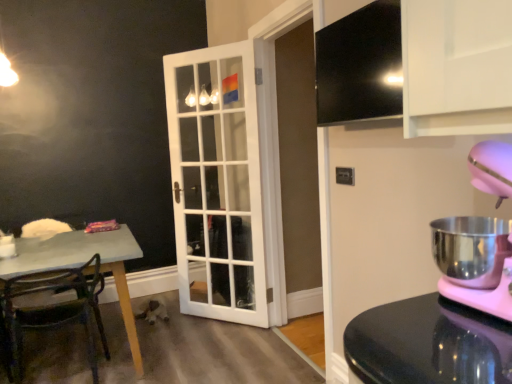
Locate an element on the screen. The height and width of the screenshot is (384, 512). metallic green chair at left is located at coordinates (55, 308).

What do you see at coordinates (492, 167) in the screenshot? I see `pink plastic mixer at right` at bounding box center [492, 167].

In order to face white glass door at center, should I rotate leftwards or rightwards?

To face it directly, rotate left by 5.416 degrees.

I want to click on white glossy coffee cup at lower left, so click(x=7, y=247).

Would you say white glass door at center is outside black glossy exhaust hood at upper right?

That's correct, white glass door at center is outside of black glossy exhaust hood at upper right.

Can you confirm if white glass door at center is positioned to the right of black glossy exhaust hood at upper right?

No.

Considering the sizes of objects white glass door at center and black glossy exhaust hood at upper right in the image provided, who is shorter, white glass door at center or black glossy exhaust hood at upper right?

black glossy exhaust hood at upper right is shorter.

Considering their positions, is white glass door at center located in front of or behind black glossy exhaust hood at upper right?

white glass door at center is positioned farther from the viewer than black glossy exhaust hood at upper right.

This screenshot has width=512, height=384. In order to click on coffee cup directly beneath the pink plastic mixer at right (from a real-world perspective) in this screenshot , I will do `click(7, 247)`.

Considering the sizes of white glossy coffee cup at lower left and pink plastic mixer at right in the image, is white glossy coffee cup at lower left bigger or smaller than pink plastic mixer at right?

Clearly, white glossy coffee cup at lower left is smaller in size than pink plastic mixer at right.

Does white glossy coffee cup at lower left appear on the right side of pink plastic mixer at right?

No.

Are white glossy coffee cup at lower left and pink plastic mixer at right located far from each other?

Absolutely, white glossy coffee cup at lower left is distant from pink plastic mixer at right.

Which of these two, pink plastic mixer at right or white glass door at center, is wider?

pink plastic mixer at right.

From a real-world perspective, is pink plastic mixer at right located higher than white glass door at center?

Yes, from a real-world perspective, pink plastic mixer at right is on top of white glass door at center.

How different are the orientations of pink plastic mixer at right and white glass door at center in degrees?

The angular difference between pink plastic mixer at right and white glass door at center is 133 degrees.

Between point (486, 184) and point (228, 89), which one is positioned in front?

The point (486, 184) is closer to the camera.

Is white glass door at center looking in the opposite direction of metallic green chair at left?

No, metallic green chair at left is not at the back of white glass door at center.

Is white glass door at center taller or shorter than metallic green chair at left?

In the image, white glass door at center appears to be taller than metallic green chair at left.

Considering the relative positions of white glass door at center and metallic green chair at left in the image provided, is white glass door at center behind metallic green chair at left?

Yes.

Based on the photo, from the image's perspective, which object appears higher, white glass door at center or metallic green chair at left?

white glass door at center is shown above in the image.

Could you tell me if black glossy exhaust hood at upper right is turned towards metallic green chair at left?

No, black glossy exhaust hood at upper right is not aimed at metallic green chair at left.

Can you confirm if black glossy exhaust hood at upper right is taller than metallic green chair at left?

No, black glossy exhaust hood at upper right is not taller than metallic green chair at left.

Who is bigger, black glossy exhaust hood at upper right or metallic green chair at left?

Bigger between the two is metallic green chair at left.

Would you say pink plastic mixer at right is inside or outside white glossy coffee cup at lower left?

pink plastic mixer at right is not inside white glossy coffee cup at lower left, it's outside.

Is point (492, 186) in front of point (3, 238)?

That is True.

Looking at this image, is pink plastic mixer at right wider than white glossy coffee cup at lower left?

Yes, pink plastic mixer at right is wider than white glossy coffee cup at lower left.

Is the depth of pink plastic mixer at right greater than that of white glossy coffee cup at lower left?

No, pink plastic mixer at right is in front of white glossy coffee cup at lower left.

How many degrees apart are the facing directions of pink plastic mixer at right and metallic green chair at left?

8.64e-05 degrees.

From a real-world perspective, does pink plastic mixer at right stand above metallic green chair at left?

Yes, from a real-world perspective, pink plastic mixer at right is above metallic green chair at left.

Are pink plastic mixer at right and metallic green chair at left located far from each other?

pink plastic mixer at right is positioned a significant distance from metallic green chair at left.

Is pink plastic mixer at right inside or outside of metallic green chair at left?

pink plastic mixer at right is not enclosed by metallic green chair at left.

In order to click on door on the left of black glossy exhaust hood at upper right in this screenshot , I will do `click(217, 183)`.

Where is `coffee cup below the pink plastic mixer at right (from a real-world perspective)`? Image resolution: width=512 pixels, height=384 pixels. coffee cup below the pink plastic mixer at right (from a real-world perspective) is located at coordinates (7, 247).

When comparing their distances from black glossy exhaust hood at upper right, does white glass door at center or white glossy coffee cup at lower left seem closer?

Among the two, white glass door at center is located nearer to black glossy exhaust hood at upper right.

Looking at the image, which one is located further to pink plastic mixer at right, white glossy coffee cup at lower left or white glass door at center?

white glossy coffee cup at lower left lies further to pink plastic mixer at right than the other object.

Looking at the image, which one is located closer to white glass door at center, metallic green chair at left or white glossy coffee cup at lower left?

Based on the image, metallic green chair at left appears to be nearer to white glass door at center.

Considering their positions, is white glossy coffee cup at lower left positioned closer to black glossy exhaust hood at upper right than pink plastic mixer at right?

Based on the image, pink plastic mixer at right appears to be nearer to black glossy exhaust hood at upper right.

Based on their spatial positions, is pink plastic mixer at right or white glossy coffee cup at lower left closer to white glass door at center?

Based on the image, white glossy coffee cup at lower left appears to be nearer to white glass door at center.

Considering their positions, is metallic green chair at left positioned further to pink plastic mixer at right than black glossy exhaust hood at upper right?

The object further to pink plastic mixer at right is metallic green chair at left.

From the image, which object appears to be nearer to pink plastic mixer at right, white glass door at center or black glossy exhaust hood at upper right?

black glossy exhaust hood at upper right.

When comparing their distances from white glass door at center, does pink plastic mixer at right or black glossy exhaust hood at upper right seem further?

Based on the image, pink plastic mixer at right appears to be further to white glass door at center.

Locate an element on the screen. The width and height of the screenshot is (512, 384). exhaust hood between white glossy coffee cup at lower left and pink plastic mixer at right is located at coordinates (360, 66).

Identify the location of chair located between white glossy coffee cup at lower left and white glass door at center in the left-right direction. This screenshot has height=384, width=512. (55, 308).

Where is `chair located between pink plastic mixer at right and white glass door at center in the depth direction`? chair located between pink plastic mixer at right and white glass door at center in the depth direction is located at coordinates (55, 308).

Locate an element on the screen. Image resolution: width=512 pixels, height=384 pixels. door located between white glossy coffee cup at lower left and pink plastic mixer at right in the left-right direction is located at coordinates (217, 183).